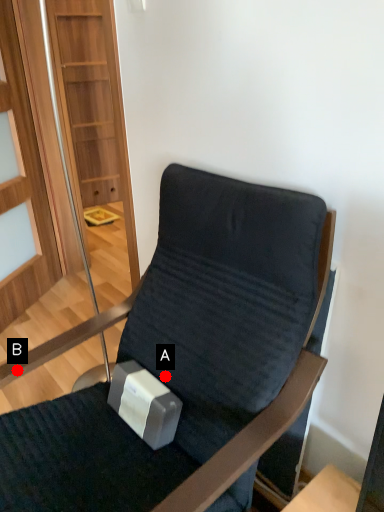
Question: Two points are circled on the image, labeled by A and B beside each circle. Which point is closer to the camera taking this photo?

Choices:
 (A) A is closer
 (B) B is closer

Answer: (B)